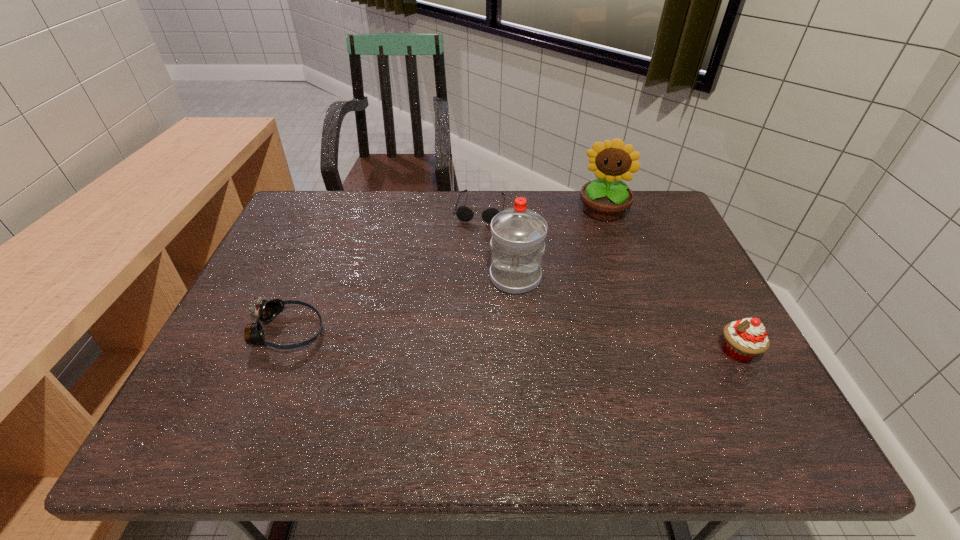
The width and height of the screenshot is (960, 540). What are the coordinates of `the leftmost object` in the screenshot? It's located at (265, 311).

Find the location of a particular element. the third shortest object is located at coordinates (745, 339).

Image resolution: width=960 pixels, height=540 pixels. I want to click on the rightmost object, so click(x=745, y=339).

Locate an element on the screen. This screenshot has width=960, height=540. the second object from right to left is located at coordinates (606, 199).

In order to click on water bottle in this screenshot , I will do `click(517, 244)`.

Image resolution: width=960 pixels, height=540 pixels. In order to click on the shortest object in this screenshot , I will do `click(463, 213)`.

You are a GUI agent. You are given a task and a screenshot of the screen. Output one action in this format:
    pyautogui.click(x=<x>, y=<y>)
    Task: Click on the vacant space positioned 0.370m through the lenses of the leftmost object
    
    Given the screenshot: What is the action you would take?
    pyautogui.click(x=484, y=332)

You are a GUI agent. You are given a task and a screenshot of the screen. Output one action in this format:
    pyautogui.click(x=<x>, y=<y>)
    Task: Click on the vacant position located on the left of the rightmost object
    
    Given the screenshot: What is the action you would take?
    pyautogui.click(x=572, y=352)

Find the location of `vacant space located on the face of the second object from right to left`. vacant space located on the face of the second object from right to left is located at coordinates pos(575,320).

Where is `vacant space located on the face of the second object from right to left`? vacant space located on the face of the second object from right to left is located at coordinates (592, 251).